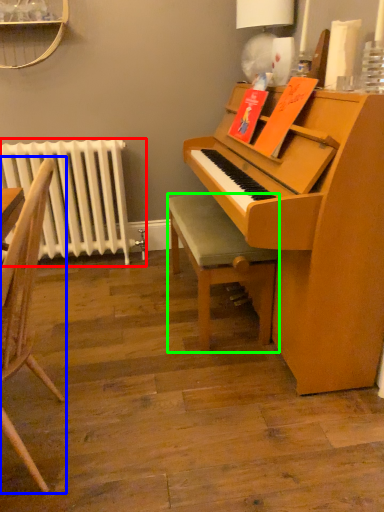
Question: Considering the real-world distances, which object is closest to radiator (highlighted by a red box)? chair (highlighted by a blue box) or stool (highlighted by a green box).

Choices:
 (A) chair
 (B) stool

Answer: (B)